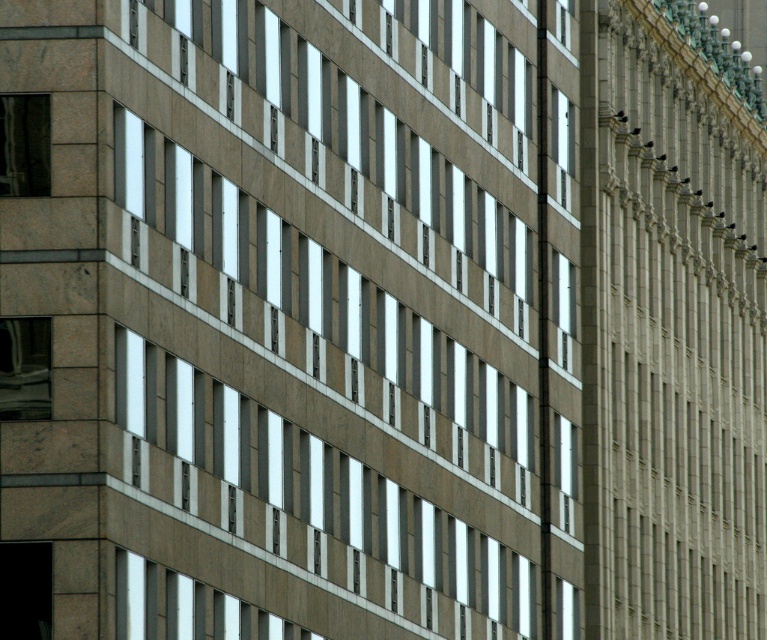
Can you confirm if matte glass window at upper left is positioned to the left of matte glass window at upper center?

Indeed, matte glass window at upper left is positioned on the left side of matte glass window at upper center.

Is the position of matte glass window at upper left less distant than that of matte glass window at upper center?

Yes, matte glass window at upper left is closer to the viewer.

Is point (8, 147) positioned after point (561, 51)?

No, (8, 147) is closer to viewer.

In order to click on matte glass window at upper left in this screenshot , I will do `click(25, 145)`.

In the scene shown: Which is below, matte glass window at lower left or clear glass window at center?

Positioned lower is matte glass window at lower left.

Is matte glass window at lower left above clear glass window at center?

No, matte glass window at lower left is not above clear glass window at center.

Between point (10, 376) and point (570, 308), which one is positioned behind?

The point (570, 308) is more distant.

The width and height of the screenshot is (767, 640). Find the location of `matte glass window at lower left`. matte glass window at lower left is located at coordinates (25, 368).

Does point (2, 346) lie behind point (44, 136)?

No, (2, 346) is in front of (44, 136).

Does matte glass window at lower left lie behind matte glass window at upper left?

Answer: No, matte glass window at lower left is in front of matte glass window at upper left.

You are a GUI agent. You are given a task and a screenshot of the screen. Output one action in this format:
    pyautogui.click(x=<x>, y=<y>)
    Task: Click on the matte glass window at lower left
    The image size is (767, 640).
    Given the screenshot: What is the action you would take?
    pos(25,368)

In order to click on matte glass window at lower left in this screenshot , I will do `click(25, 368)`.